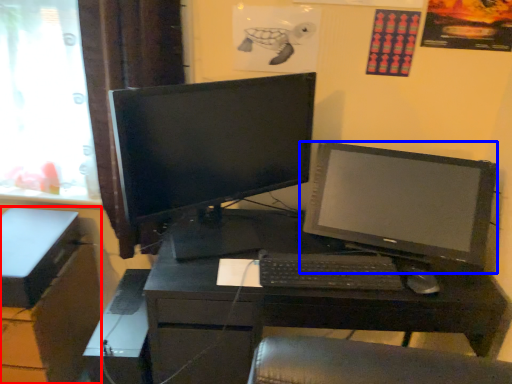
Question: Which object appears farthest to the camera in this image, file cabinet (highlighted by a red box) or computer monitor (highlighted by a blue box)?

Choices:
 (A) file cabinet
 (B) computer monitor

Answer: (A)